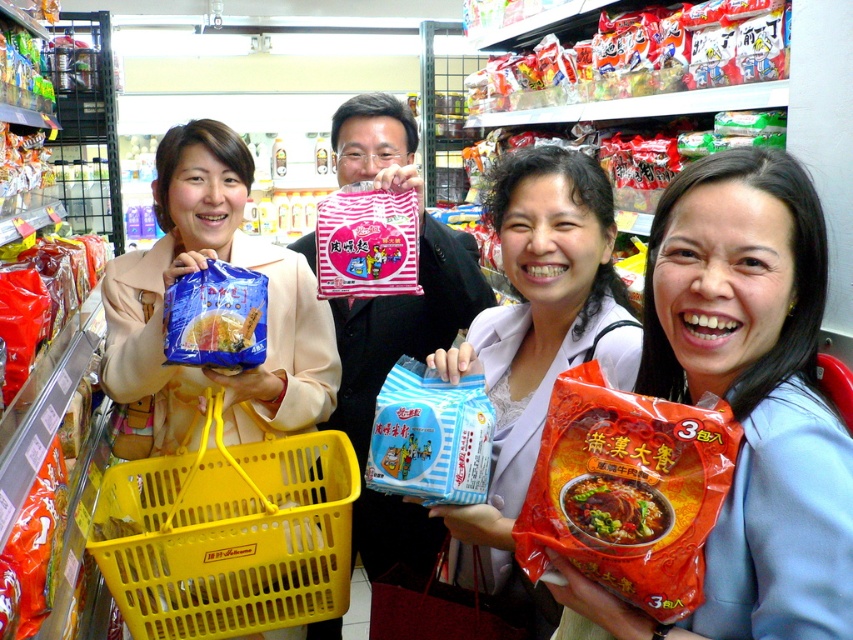
You are a cashier at the store and need to place the matte blue plastic bag at center and the matte plastic bag at center into a storage bin. Which bag should you place first if you want to maximize the number of bags that fit in the bin?

The matte blue plastic bag at center is smaller than the matte plastic bag at center, so you should place the matte blue plastic bag at center first to maximize the number of bags that fit in the bin.

You are a customer in the store and want to grab both the matte orange snack bag at center and the matte blue plastic bag at center. Which one should you reach for first if you want to pick up the one on the left first?

The matte blue plastic bag at center is on the left side of the matte orange snack bag at center, so you should reach for the matte blue plastic bag at center first.